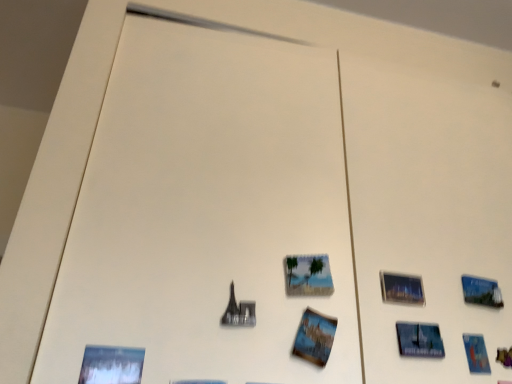
Question: Which direction should I rotate to look at printed paper postcard at center, which is the second postcard from right to left, — up or down?

Choices:
 (A) down
 (B) up

Answer: (A)

Question: Does blue glossy postcard at lower right, the 1th postcard positioned from the back, have a larger size compared to printed paper postcard at center, the 1th postcard from the front?

Choices:
 (A) yes
 (B) no

Answer: (B)

Question: Is blue glossy postcard at lower right, the 1th postcard positioned from the back, oriented towards printed paper postcard at center, which appears as the first postcard when viewed from the left?

Choices:
 (A) yes
 (B) no

Answer: (B)

Question: Is blue glossy postcard at lower right, which ranks as the second postcard in front-to-back order, touching printed paper postcard at center, which appears as the first postcard when viewed from the left?

Choices:
 (A) no
 (B) yes

Answer: (A)

Question: From a real-world perspective, is blue glossy postcard at lower right, the 1th postcard positioned from the back, under printed paper postcard at center, which is the second postcard from right to left?

Choices:
 (A) no
 (B) yes

Answer: (B)

Question: Does blue glossy postcard at lower right, the 1th postcard positioned from the back, have a greater height compared to printed paper postcard at center, which is the second postcard from right to left?

Choices:
 (A) no
 (B) yes

Answer: (A)

Question: From the image's perspective, would you say blue glossy postcard at lower right, placed as the 2th postcard when sorted from left to right, is positioned over printed paper postcard at center, which is the second postcard from back to front?

Choices:
 (A) yes
 (B) no

Answer: (B)

Question: Can you confirm if matte plastic picture frame at center, which is the first picture frame from left to right, is wider than metallic glass picture frame at upper right, arranged as the first picture frame when viewed from the right?

Choices:
 (A) yes
 (B) no

Answer: (B)

Question: From the image's perspective, is matte plastic picture frame at center, which is the first picture frame from left to right, over metallic glass picture frame at upper right, arranged as the first picture frame when viewed from the right?

Choices:
 (A) yes
 (B) no

Answer: (A)

Question: Can you confirm if matte plastic picture frame at center, which is the first picture frame from left to right, is smaller than metallic glass picture frame at upper right, marked as the 2th picture frame in a left-to-right arrangement?

Choices:
 (A) no
 (B) yes

Answer: (B)

Question: From the image's perspective, would you say matte plastic picture frame at center, the 2th picture frame in the right-to-left sequence, is shown under metallic glass picture frame at upper right, arranged as the first picture frame when viewed from the right?

Choices:
 (A) yes
 (B) no

Answer: (B)

Question: From a real-world perspective, is matte plastic picture frame at center, which is the first picture frame from left to right, under metallic glass picture frame at upper right, arranged as the first picture frame when viewed from the right?

Choices:
 (A) yes
 (B) no

Answer: (B)

Question: Considering the relative positions of matte plastic picture frame at center, the 2th picture frame in the right-to-left sequence, and metallic glass picture frame at upper right, arranged as the first picture frame when viewed from the right, in the image provided, is matte plastic picture frame at center, the 2th picture frame in the right-to-left sequence, to the right of metallic glass picture frame at upper right, arranged as the first picture frame when viewed from the right, from the viewer's perspective?

Choices:
 (A) yes
 (B) no

Answer: (B)

Question: Does printed paper postcard at center, which is the second postcard from back to front, appear on the left side of blue glossy postcard at lower right, the 1th postcard from the right?

Choices:
 (A) yes
 (B) no

Answer: (A)